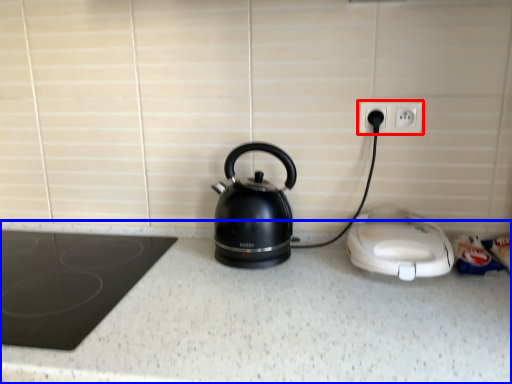
Question: Which of the following is the closest to the observer, electric outlet (highlighted by a red box) or counter top (highlighted by a blue box)?

Choices:
 (A) electric outlet
 (B) counter top

Answer: (B)